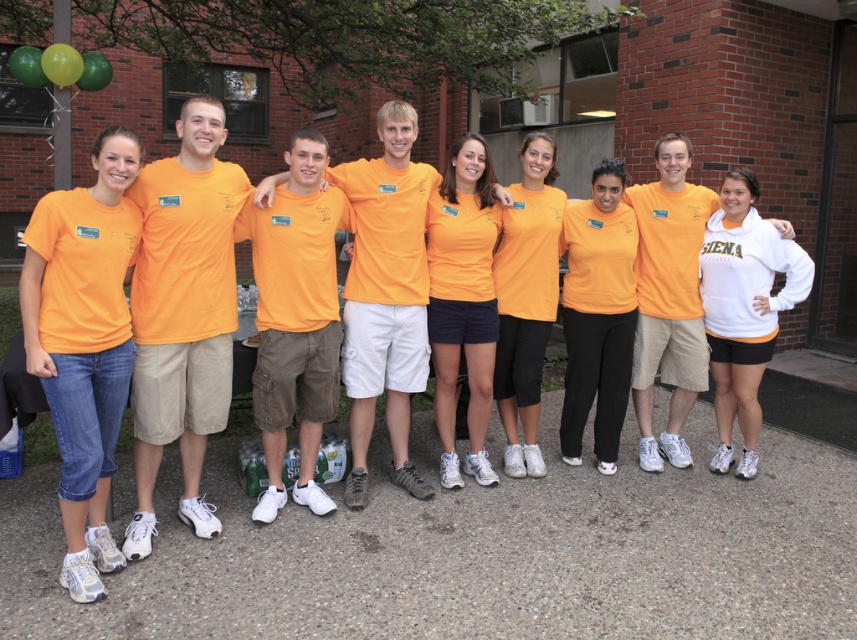
You are standing in front of the brick building and want to find the orange matte shorts at center. According to the coordinates provided, where should you look relative to the center of the image?

The orange matte shorts at center is located at the coordinates point 0.469 on the x axis and 0.541 on the y axis, which is slightly to the right and above the center of the image.